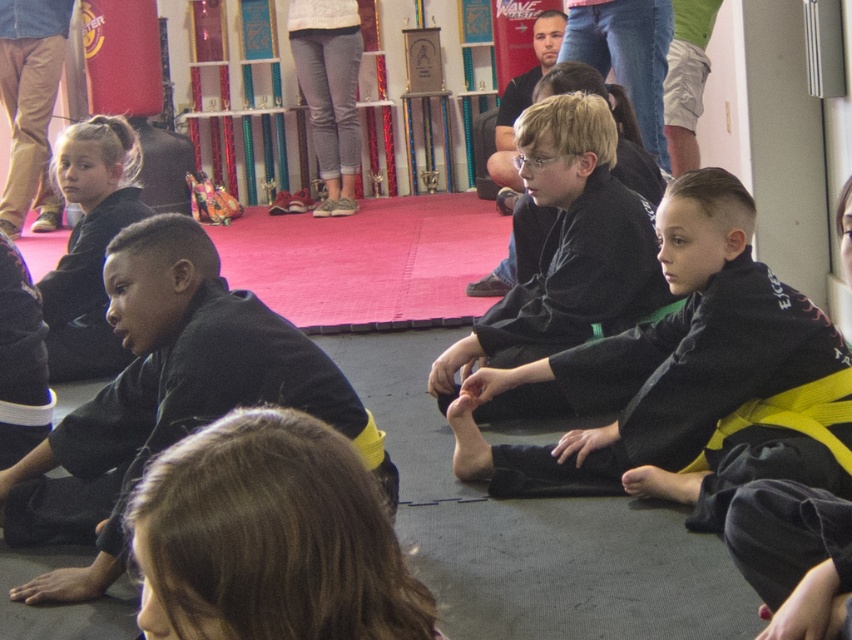
Question: Does black matte karate uniform at center appear on the left side of black matte karate gi at center?

Choices:
 (A) yes
 (B) no

Answer: (B)

Question: Does black matte karate gi at left lie in front of black matte karate gi at center?

Choices:
 (A) yes
 (B) no

Answer: (A)

Question: Which of the following is the farthest from the observer?

Choices:
 (A) (122, 131)
 (B) (165, 502)

Answer: (A)

Question: Which object appears closest to the camera in this image?

Choices:
 (A) black matte karate uniform at center
 (B) brown hair at lower center
 (C) black matte karate gi at center
 (D) matte black karate gi at left

Answer: (B)

Question: Estimate the real-world distances between objects in this image. Which object is farther from the brown hair at lower center?

Choices:
 (A) matte black karate gi at left
 (B) black matte karate gi at left
 (C) black matte karate gi at center

Answer: (A)

Question: Does black matte karate uniform at center have a lesser width compared to brown hair at lower center?

Choices:
 (A) no
 (B) yes

Answer: (A)